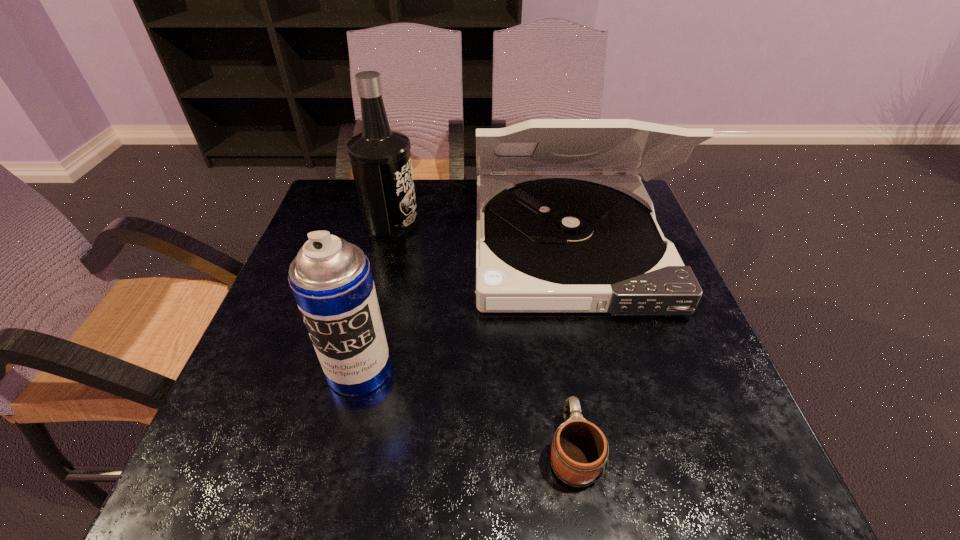
The image size is (960, 540). What are the coordinates of `free space between the CD player and the aerosol can` in the screenshot? It's located at pyautogui.click(x=464, y=308).

Select which object appears as the closest to the shortest object. Please provide its 2D coordinates. Your answer should be formatted as a tuple, i.e. [(x, y)], where the tuple contains the x and y coordinates of a point satisfying the conditions above.

[(545, 243)]

At what (x,y) coordinates should I click in order to perform the action: click on the third closest object relative to the CD player. Please return your answer as a coordinate pair (x, y). This screenshot has width=960, height=540. Looking at the image, I should click on (579, 451).

Where is `free space that satisfies the following two spatial constraints: 1. on the front label of the liquor; 2. on the side of the shortest object with the handle`? This screenshot has height=540, width=960. free space that satisfies the following two spatial constraints: 1. on the front label of the liquor; 2. on the side of the shortest object with the handle is located at coordinates (334, 451).

At what (x,y) coordinates should I click in order to perform the action: click on vacant region that satisfies the following two spatial constraints: 1. on the front label of the liquor; 2. on the side of the mug with the handle. Please return your answer as a coordinate pair (x, y). The image size is (960, 540). Looking at the image, I should click on (334, 451).